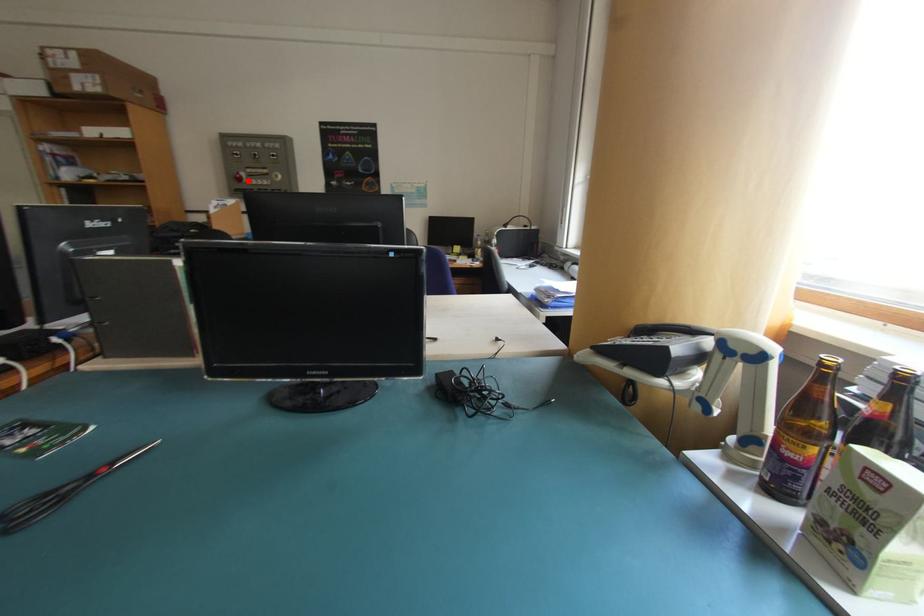
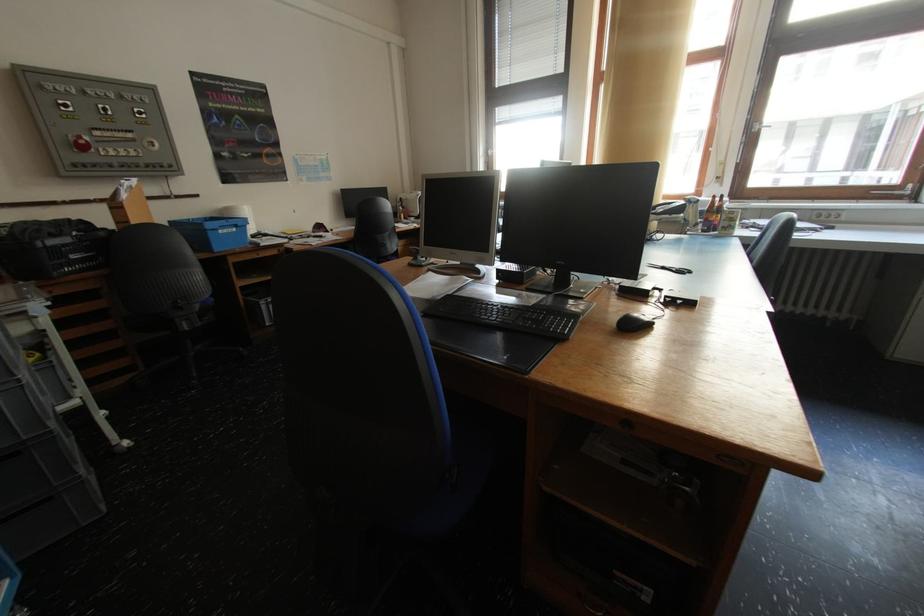
The point at the highlighted location is marked in the first image. Where is the corresponding point in the second image?

(91, 148)